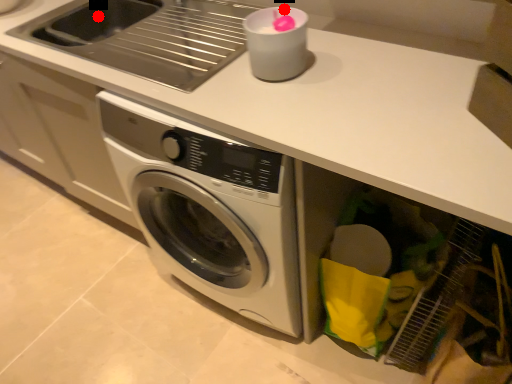
Question: Two points are circled on the image, labeled by A and B beside each circle. Which point is farther from the camera taking this photo?

Choices:
 (A) A is further
 (B) B is further

Answer: (A)